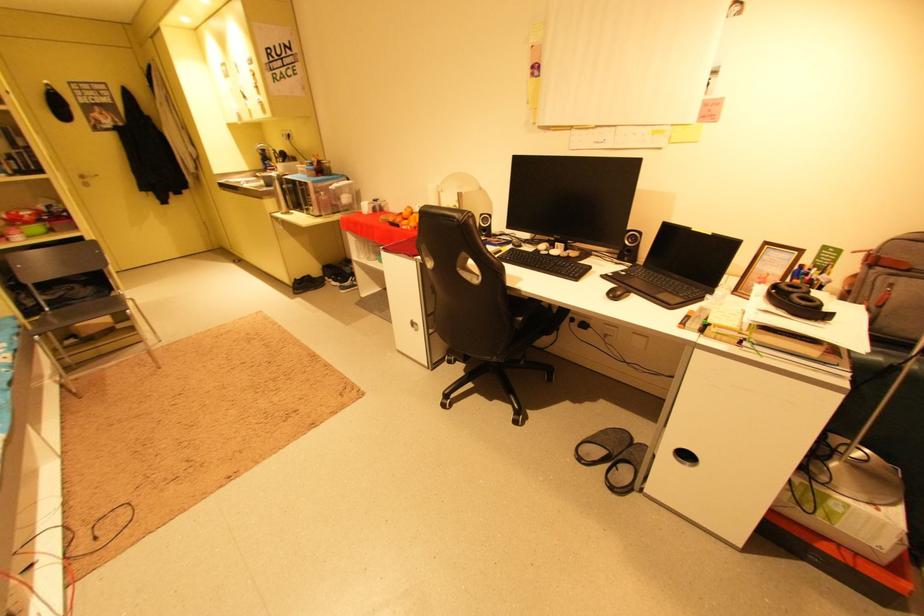
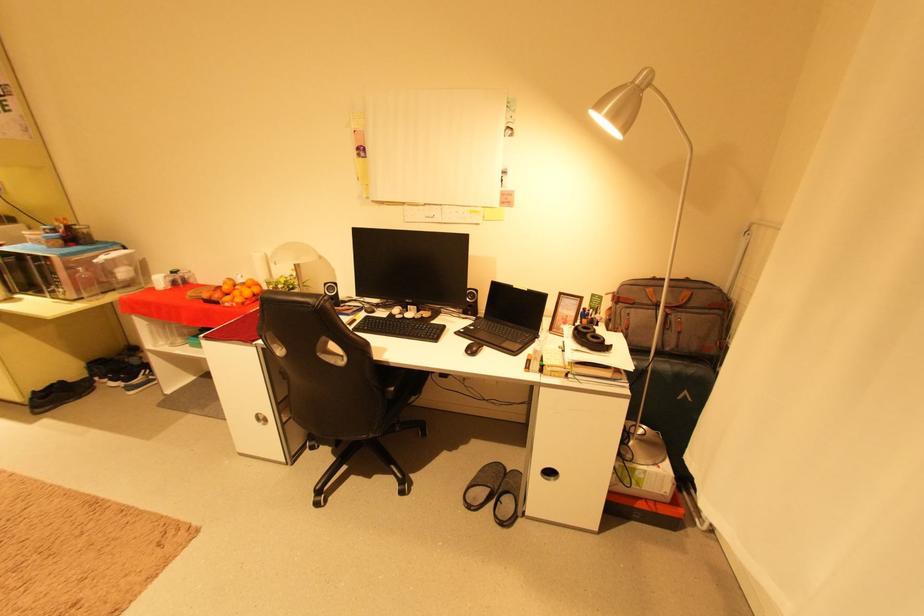
Where in the second image is the point corresponding to pixel 410 228 from the first image?

(235, 305)